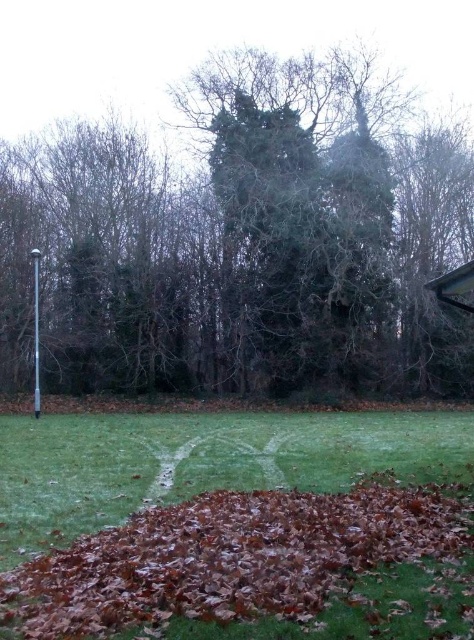
You are standing at the point closer to the camera in the image. Which point are you at, point (x=458, y=364) or point (x=1, y=435)?

You are at point (x=1, y=435) because it is closer to the camera than point (x=458, y=364).

You are planning to take a photo of the green leafy tree at center and the brown leaf litter at lower center. Which object should you focus on first if you want to capture both in a single frame without moving the camera?

The green leafy tree at center should be focused on first because its width is larger than the brown leaf litter at lower center, so it requires more attention to ensure it fits properly in the frame.